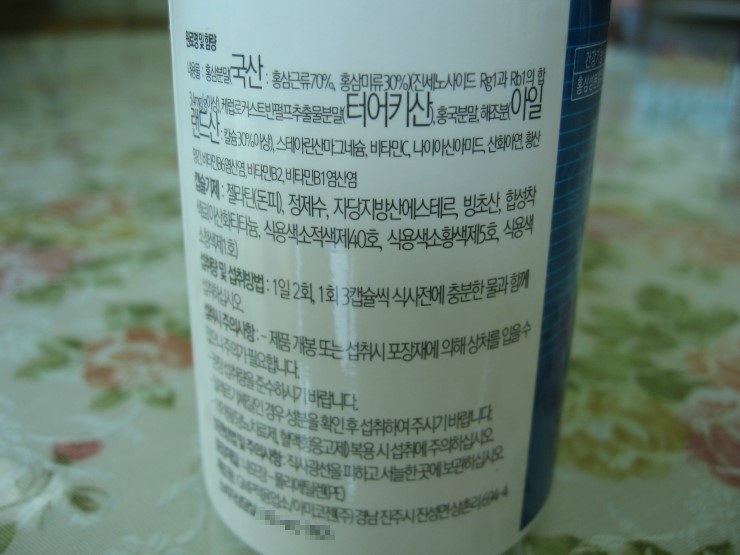
Find the location of a particular element. Image resolution: width=740 pixels, height=555 pixels. countertop is located at coordinates (669, 102).